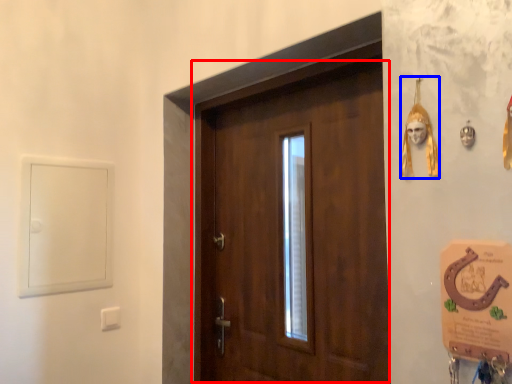
Question: Which object appears farthest to the camera in this image, door (highlighted by a red box) or decor (highlighted by a blue box)?

Choices:
 (A) door
 (B) decor

Answer: (A)